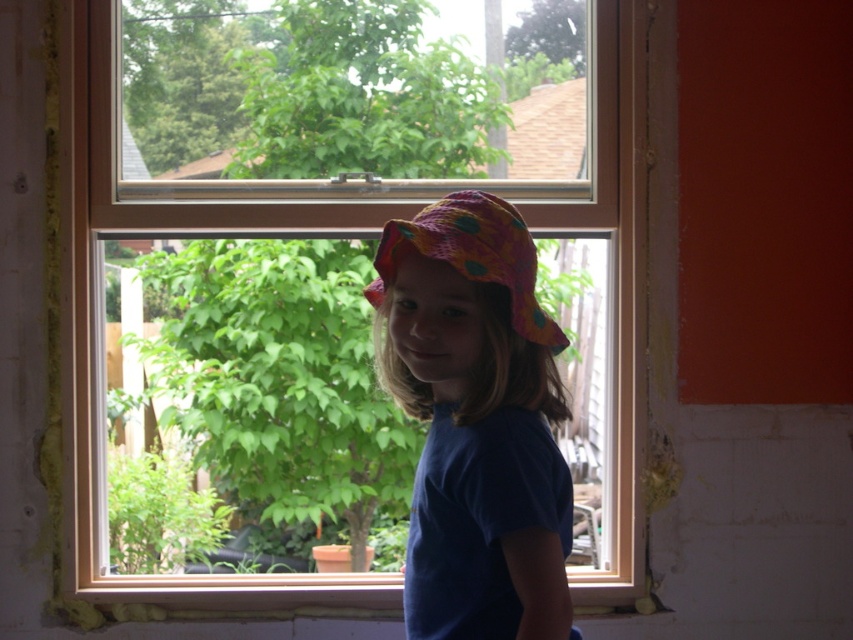
Between clear glass window at center and polka dot fabric hat at center, which one appears on the left side from the viewer's perspective?

Positioned to the left is clear glass window at center.

Which is more to the right, clear glass window at center or polka dot fabric hat at center?

polka dot fabric hat at center

Locate an element on the screen. Image resolution: width=853 pixels, height=640 pixels. clear glass window at center is located at coordinates (102, 321).

Where is `clear glass window at center`? clear glass window at center is located at coordinates click(x=102, y=321).

Where is `matte pink fabric hat at center`? matte pink fabric hat at center is located at coordinates pyautogui.click(x=476, y=420).

Locate an element on the screen. This screenshot has width=853, height=640. matte pink fabric hat at center is located at coordinates (476, 420).

Which is below, clear glass window at center or matte pink fabric hat at center?

Positioned lower is matte pink fabric hat at center.

Is clear glass window at center closer to camera compared to matte pink fabric hat at center?

No, it is behind matte pink fabric hat at center.

Does point (126, 202) lie in front of point (564, 518)?

No, it is behind (564, 518).

Where is `clear glass window at center`? Image resolution: width=853 pixels, height=640 pixels. clear glass window at center is located at coordinates (102, 321).